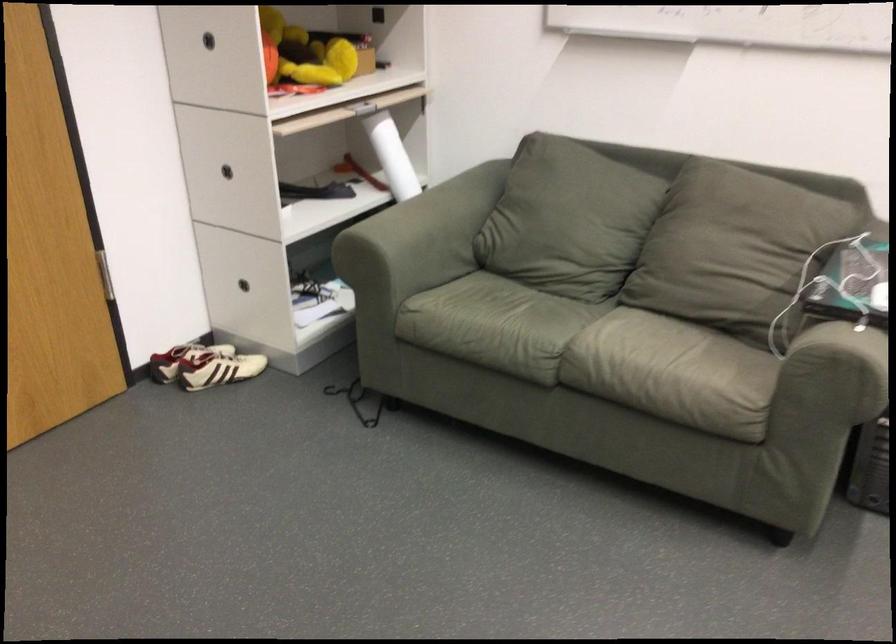
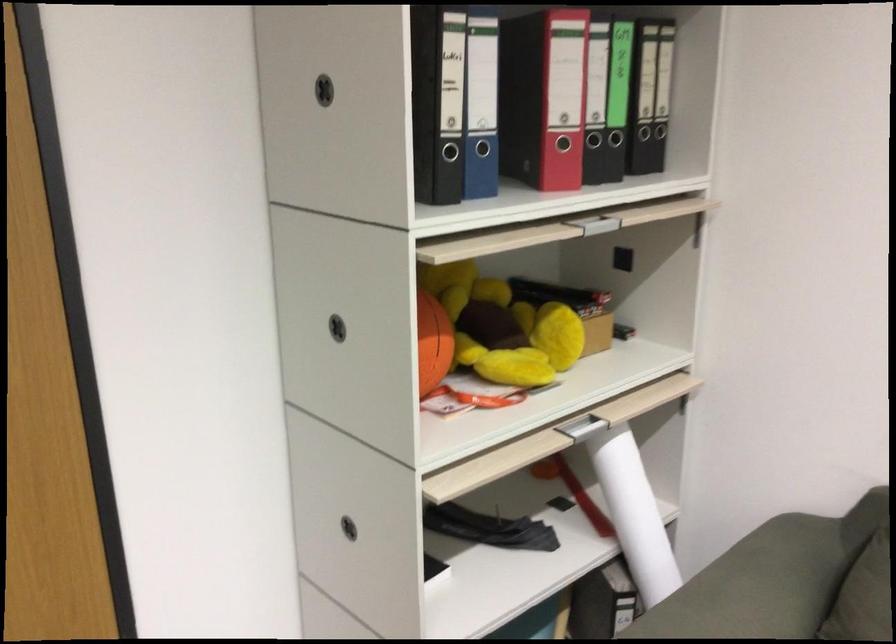
Where in the second image is the point corresponding to the point at 401,171 from the first image?

(633, 514)